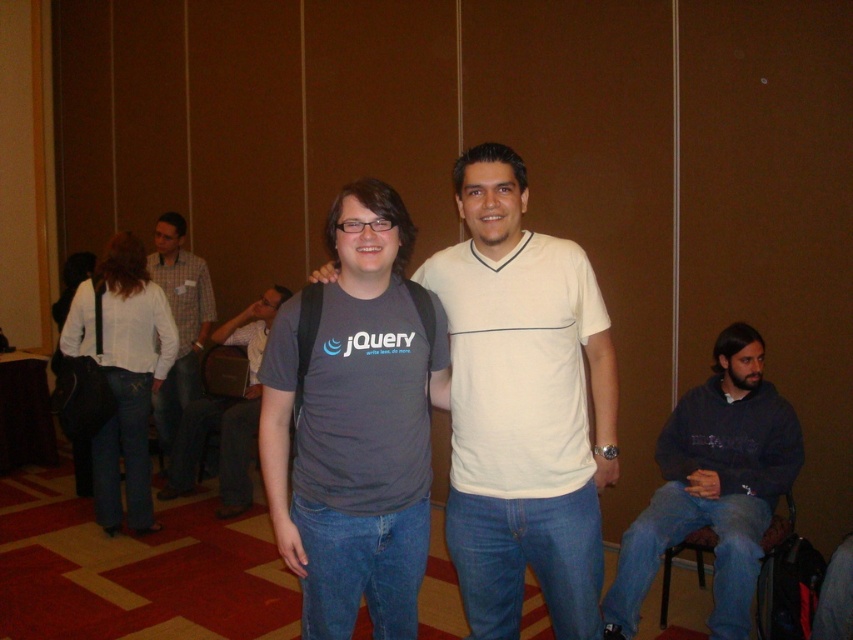
Can you confirm if dark gray sweatshirt at lower right is positioned to the right of brown fabric chair at lower right?

No, dark gray sweatshirt at lower right is not to the right of brown fabric chair at lower right.

Looking at this image, who is more distant from viewer, (x=711, y=456) or (x=787, y=513)?

Positioned behind is point (x=787, y=513).

This screenshot has width=853, height=640. I want to click on dark gray sweatshirt at lower right, so click(712, 486).

Does gray fabric shirt at center have a larger size compared to brown fabric chair at lower right?

Actually, gray fabric shirt at center might be smaller than brown fabric chair at lower right.

Is point (287, 545) less distant than point (791, 502)?

Yes, it is in front of point (791, 502).

Between point (347, 497) and point (788, 506), which one is positioned behind?

The point (788, 506) is behind.

Locate an element on the screen. Image resolution: width=853 pixels, height=640 pixels. gray fabric shirt at center is located at coordinates (357, 426).

Does white denim jeans at lower left have a smaller size compared to brown fabric chair at lower right?

Incorrect, white denim jeans at lower left is not smaller in size than brown fabric chair at lower right.

Image resolution: width=853 pixels, height=640 pixels. Describe the element at coordinates (129, 380) in the screenshot. I see `white denim jeans at lower left` at that location.

At what (x,y) coordinates should I click in order to perform the action: click on white denim jeans at lower left. Please return your answer as a coordinate pair (x, y). Looking at the image, I should click on (129, 380).